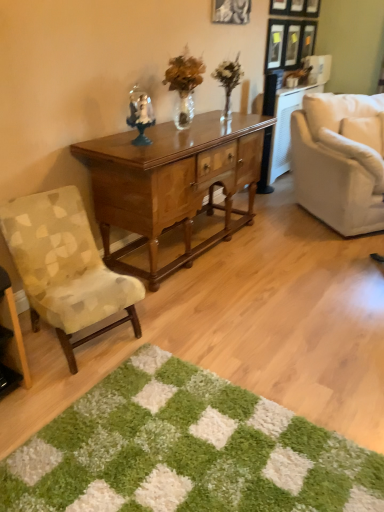
The width and height of the screenshot is (384, 512). In order to click on vacant space underneath green shaggy rug at lower center (from a real-world perspective) in this screenshot , I will do `click(183, 474)`.